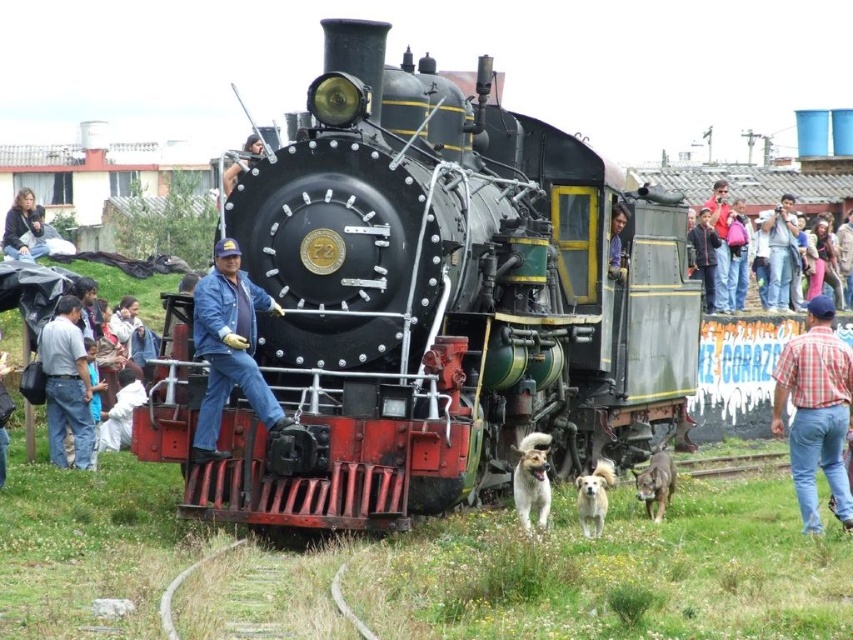
You are a photographer trying to capture the vintage steam locomotive with the plaid shirt at lower right and denim jacket at upper right in the frame. Which clothing item should you focus on first if you want to ensure both are in the shot and the smaller one is clearly visible?

The denim jacket at upper right is smaller, so you should focus on it first to ensure clarity, while also framing the plaid shirt at lower right which is larger and will naturally stand out in the composition.

You are a photographer standing at the front of the vintage steam locomotive with the number 72. You want to take a picture of the brown furry dog at center. Where should you position your camera to capture the dog in the frame?

The brown furry dog at center is located at point (x=656, y=483), so you should position your camera to aim towards those coordinates to capture the dog in the frame.